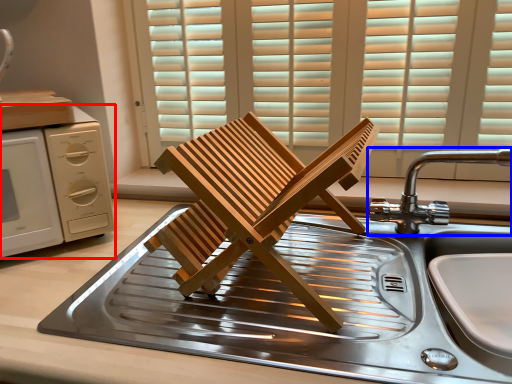
Question: Which point is further to the camera, home appliance (highlighted by a red box) or tap (highlighted by a blue box)?

Choices:
 (A) home appliance
 (B) tap

Answer: (A)